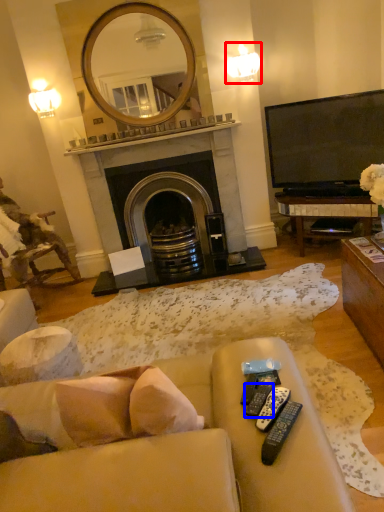
Question: Among these objects, which one is nearest to the camera, light fixture (highlighted by a red box) or remote control (highlighted by a blue box)?

Choices:
 (A) light fixture
 (B) remote control

Answer: (B)